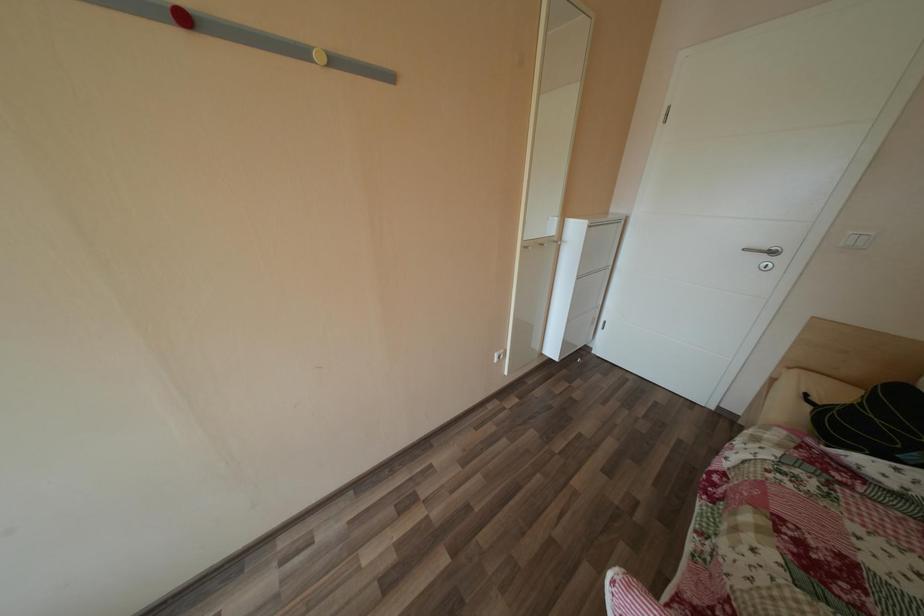
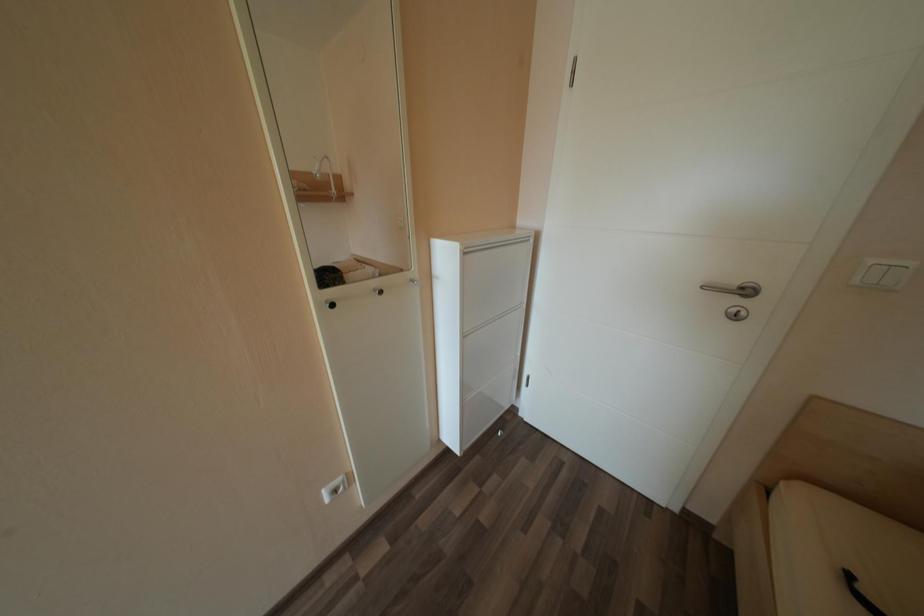
Question: The first image is from the beginning of the video and the second image is from the end. How did the camera likely rotate when shooting the video?

Choices:
 (A) Left
 (B) Right
 (C) Up
 (D) Down

Answer: (B)